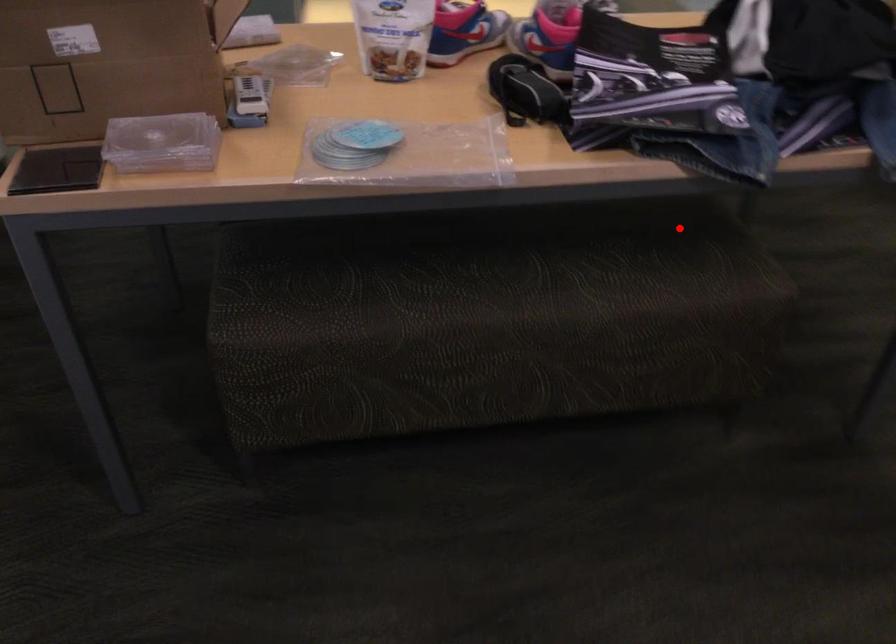
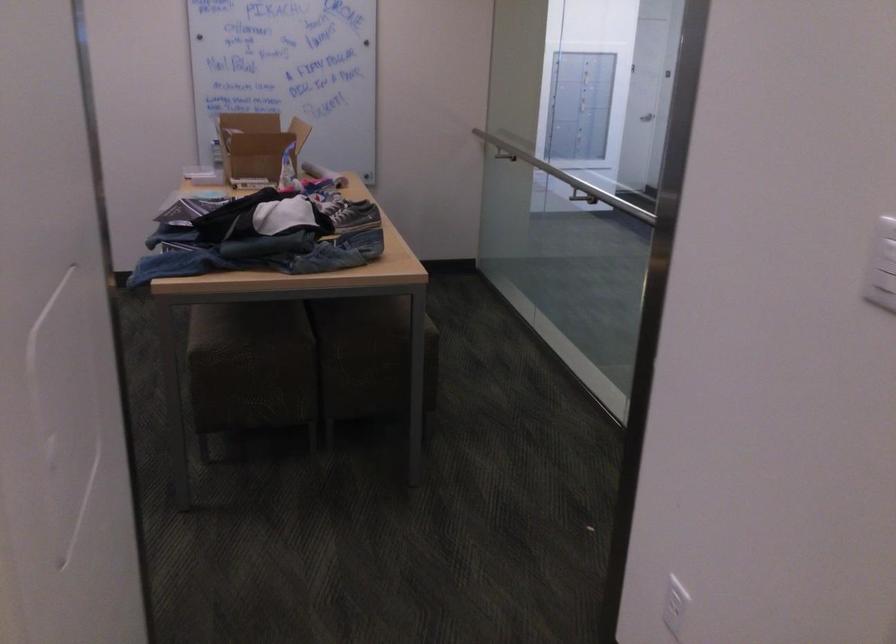
Locate, in the second image, the point that corresponds to the highlighted location in the first image.

(246, 325)